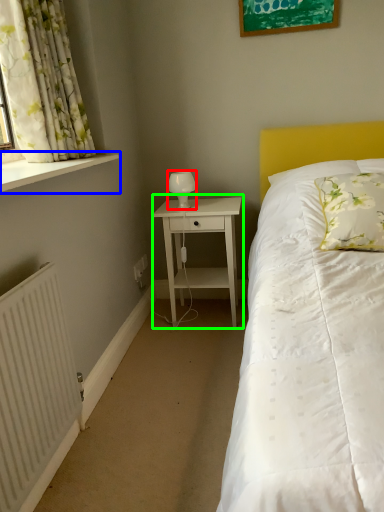
Question: Estimate the real-world distances between objects in this image. Which object is closer to table lamp (highlighted by a red box), window sill (highlighted by a blue box) or nightstand (highlighted by a green box)?

Choices:
 (A) window sill
 (B) nightstand

Answer: (B)